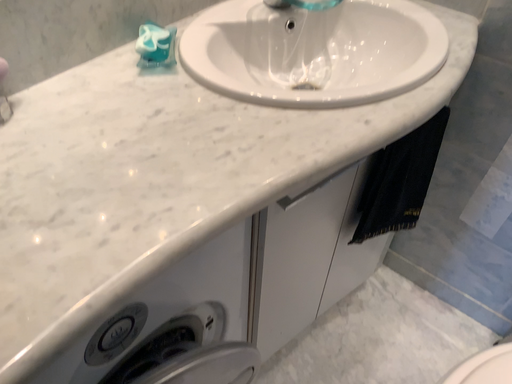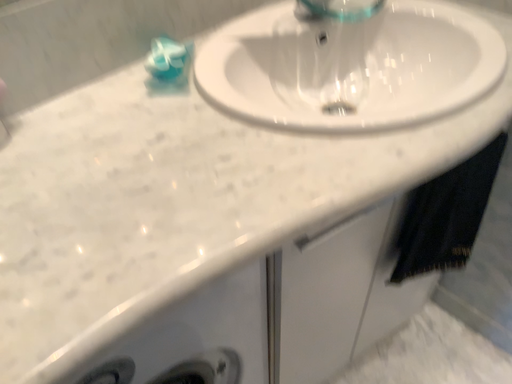
Question: Which way did the camera rotate in the video?

Choices:
 (A) rotated right
 (B) rotated left

Answer: (B)